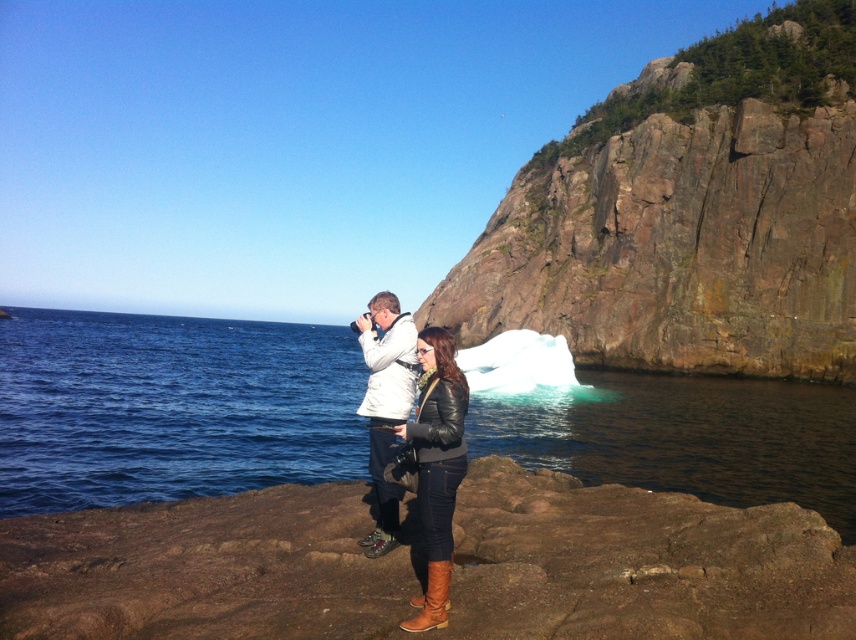
Is point (195, 470) farther from camera compared to point (373, 465)?

That is True.

Which of these two, clear blue water at center or white matte jacket at center, stands taller?

Standing taller between the two is clear blue water at center.

Does point (4, 464) come in front of point (406, 376)?

No.

Identify the location of clear blue water at center. (170, 406).

Can you confirm if clear blue water at center is taller than brown leather jacket at center?

Yes.

Can you confirm if clear blue water at center is positioned to the right of brown leather jacket at center?

No, clear blue water at center is not to the right of brown leather jacket at center.

Who is more distant from viewer, (308,460) or (438,573)?

Positioned behind is point (308,460).

Locate an element on the screen. This screenshot has height=640, width=856. clear blue water at center is located at coordinates (170, 406).

Is brown rock at center wider than rugged stone cliff at upper right?

No.

Between point (207, 632) and point (578, 211), which one is positioned behind?

Positioned behind is point (578, 211).

Who is more forward, (519, 476) or (596, 262)?

Point (519, 476) is more forward.

The height and width of the screenshot is (640, 856). In order to click on brown rock at center in this screenshot , I will do `click(637, 563)`.